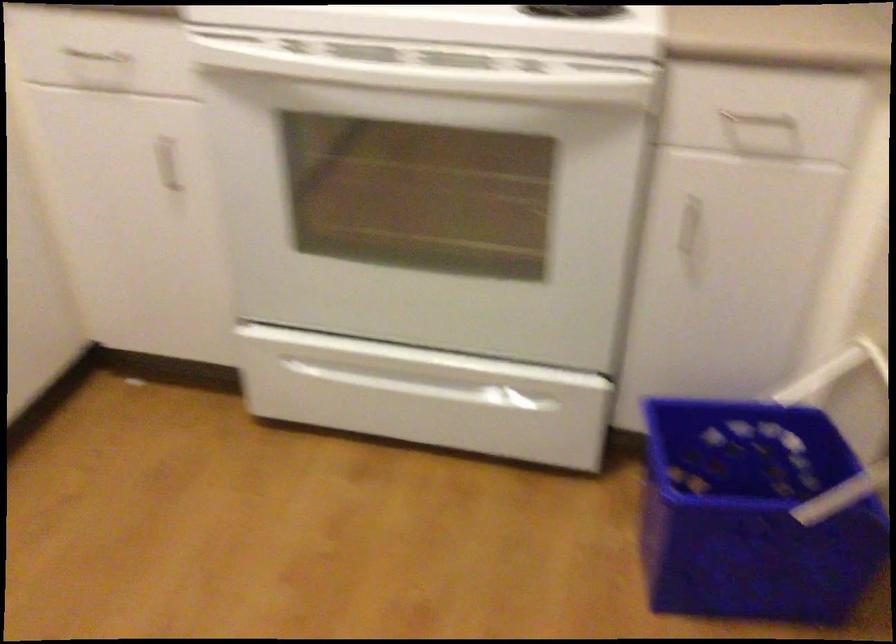
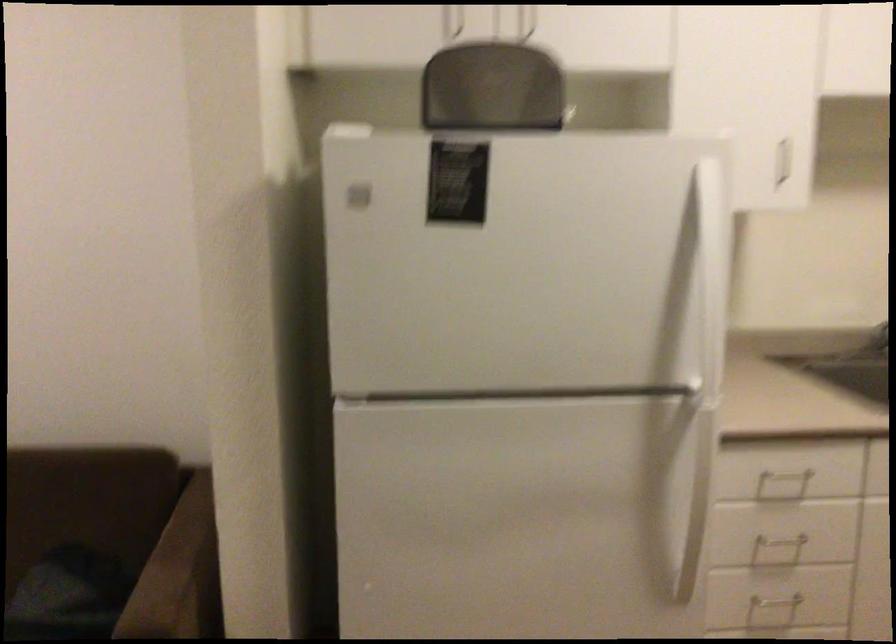
Question: The camera is either moving clockwise (left) or counter-clockwise (right) around the object. The first image is from the beginning of the video and the second image is from the end. Is the camera moving left or right when shooting the video?

Choices:
 (A) Left
 (B) Right

Answer: (B)